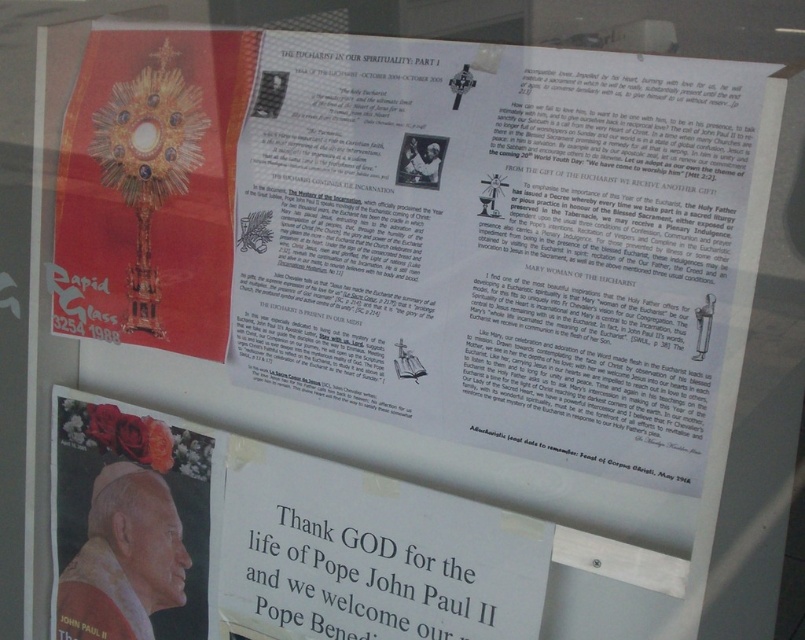
Question: Which object is positioned farthest from the gold metallic monstrance at upper left?

Choices:
 (A) white matte portrait of pope john paul ii at lower left
 (B) white paper at center

Answer: (B)

Question: Can you confirm if gold metallic monstrance at upper left is smaller than white paper at center?

Choices:
 (A) no
 (B) yes

Answer: (A)

Question: Can you confirm if white paper at center is positioned below white matte portrait of pope john paul ii at lower left?

Choices:
 (A) yes
 (B) no

Answer: (A)

Question: Which of the following is the farthest from the observer?

Choices:
 (A) gold metallic monstrance at upper left
 (B) white matte portrait of pope john paul ii at lower left

Answer: (B)

Question: Which point is farther from the camera taking this photo?

Choices:
 (A) (157, 67)
 (B) (318, 625)

Answer: (A)

Question: Is gold metallic monstrance at upper left to the left of white paper at center from the viewer's perspective?

Choices:
 (A) yes
 (B) no

Answer: (A)